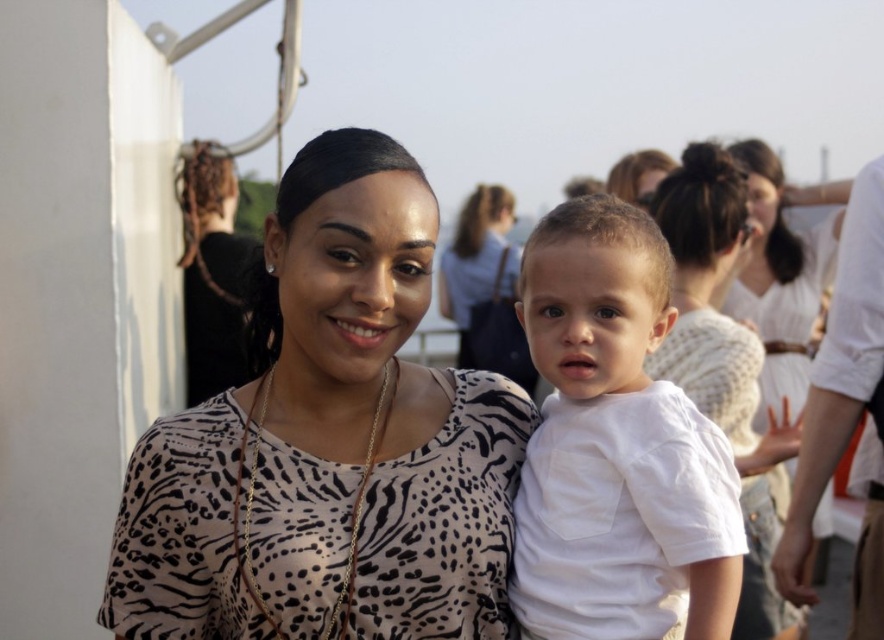
Consider the image. Looking at the two clothing items in the scene, the leopard print blouse at center and the white cotton shirt at center, which one is positioned to the left?

The leopard print blouse at center is to the left of the white cotton shirt at center.

You are standing at the point labeled as point (x=494, y=448) in the image. You want to take a photo of the woman and the child using a camera that has a 50mm lens. The camera requires a minimum distance of 25 feet to focus properly. Will you be able to take a clear photo of the woman and the child from your current position?

The distance between point (x=494, y=448) and the camera is 26.70 feet, which is greater than the minimum required 25 feet. Therefore, you can take a clear photo of the woman and the child from your current position.